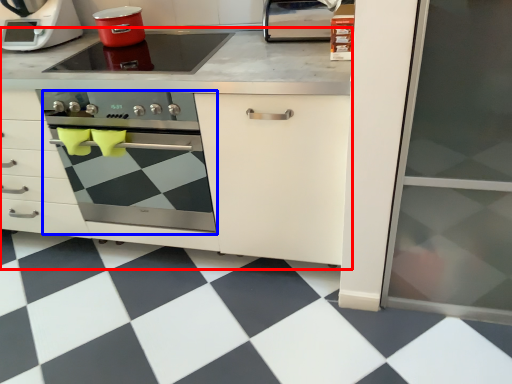
Question: Which object appears farthest to the camera in this image, cabinetry (highlighted by a red box) or oven (highlighted by a blue box)?

Choices:
 (A) cabinetry
 (B) oven

Answer: (B)